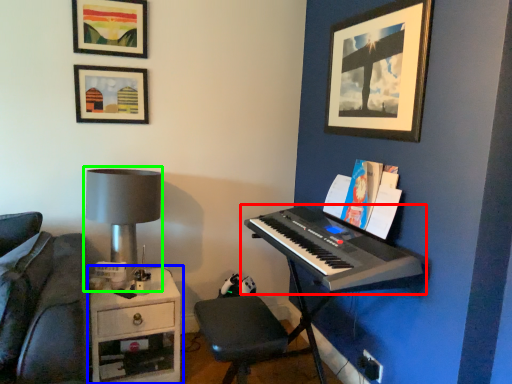
Question: Considering the real-world distances, which object is farthest from musical keyboard (highlighted by a red box)? table (highlighted by a blue box) or table lamp (highlighted by a green box)?

Choices:
 (A) table
 (B) table lamp

Answer: (A)